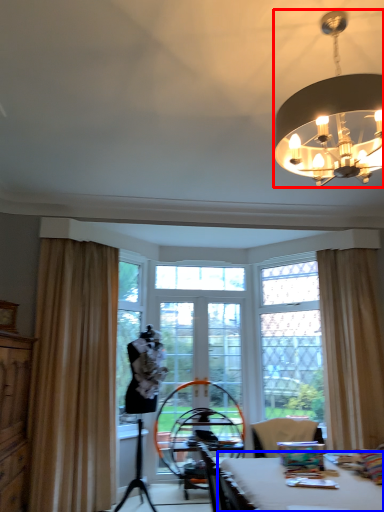
Question: Which object is closer to the camera taking this photo, lamp (highlighted by a red box) or table (highlighted by a blue box)?

Choices:
 (A) lamp
 (B) table

Answer: (B)